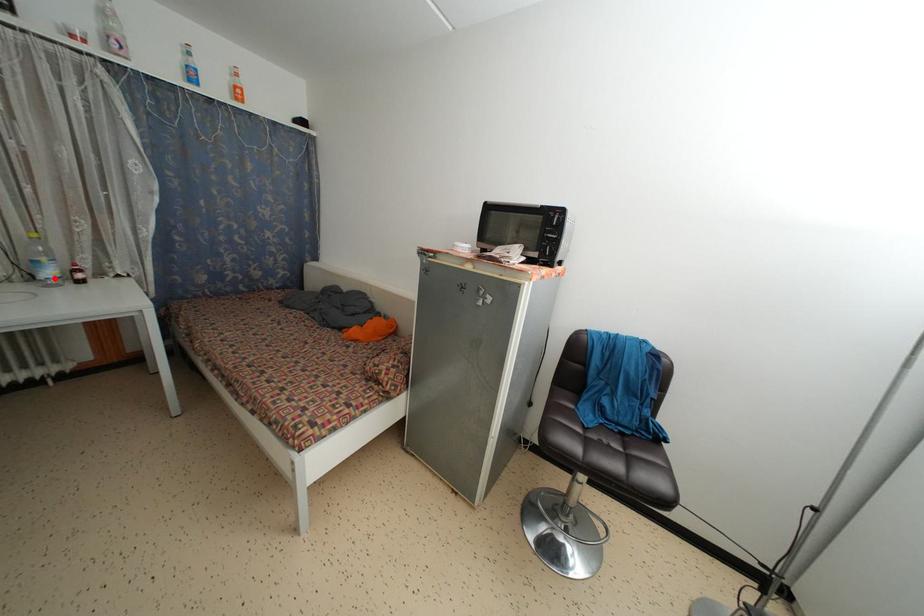
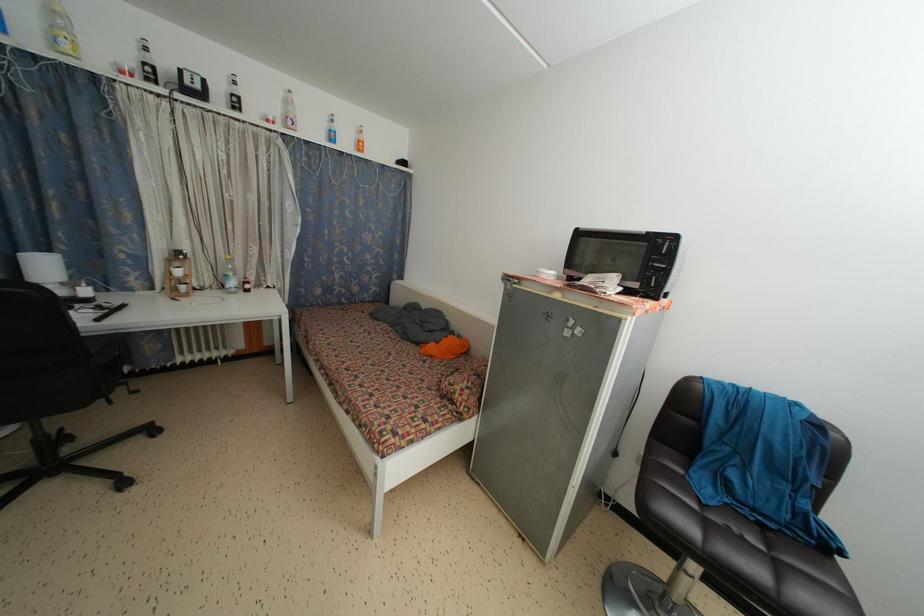
Where in the second image is the point corresponding to the highlighted location from the first image?

(237, 289)